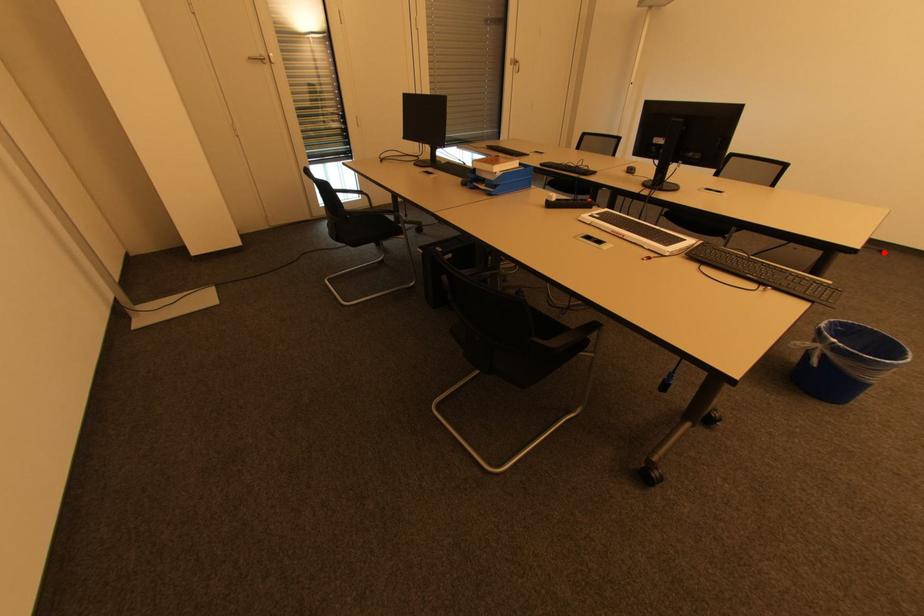
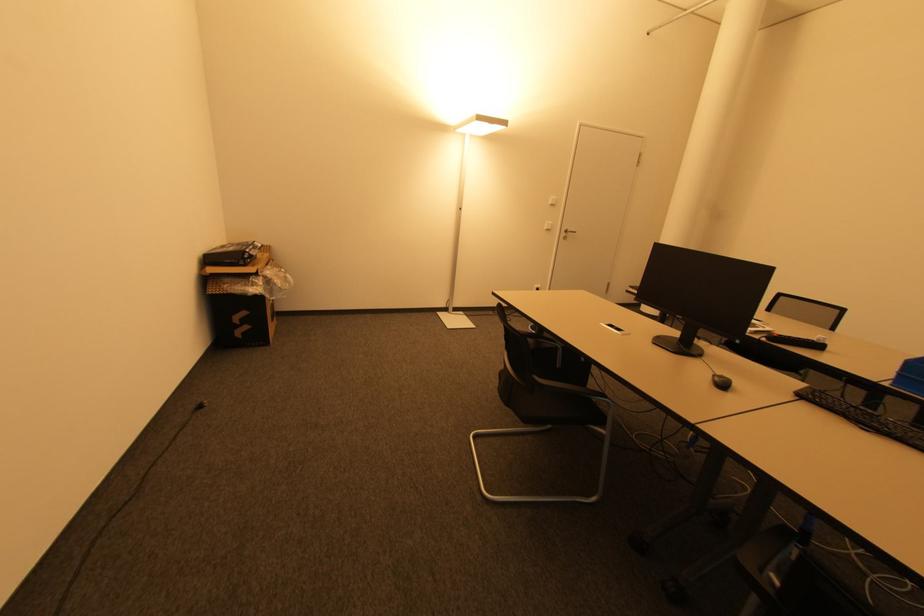
Question: I am providing you with two images of the same scene from different viewpoints. In image1, a red point is highlighted. Considering the same 3D point in image2, which of the following is correct?

Choices:
 (A) It is closer
 (B) It is farther

Answer: (A)